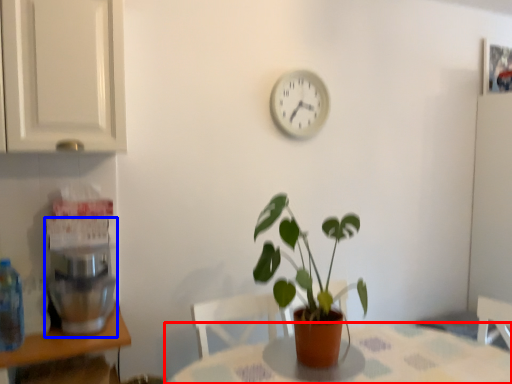
Question: Which object is closer to the camera taking this photo, table (highlighted by a red box) or coffee machine (highlighted by a blue box)?

Choices:
 (A) table
 (B) coffee machine

Answer: (A)